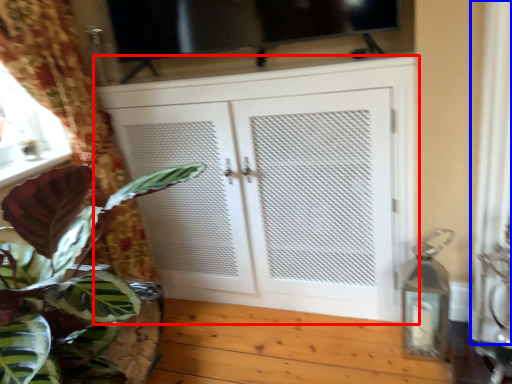
Question: Which of the following is the farthest to the observer, cupboard (highlighted by a red box) or curtain (highlighted by a blue box)?

Choices:
 (A) cupboard
 (B) curtain

Answer: (A)